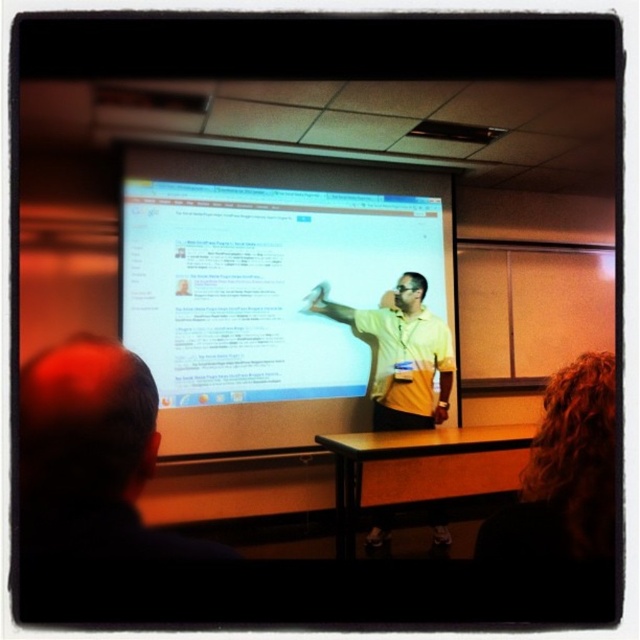
You are a student sitting in the classroom and want to take a photo of the white glossy projection screen at center and curly hair at upper right. Which object is wider?

The white glossy projection screen at center is wider than curly hair at upper right.

In the scene shown: You are a student sitting in the classroom and want to know which object is smaller between curly hair at upper right and yellow matte shirt at center. Can you tell me?

The curly hair at upper right is smaller than the yellow matte shirt at center.

You are a student sitting in the classroom and want to see both the curly hair at upper right and the yellow matte shirt at center. Can you see both at the same time without moving your head?

Yes, because the curly hair at upper right is in front of the yellow matte shirt at center, so both are visible simultaneously.